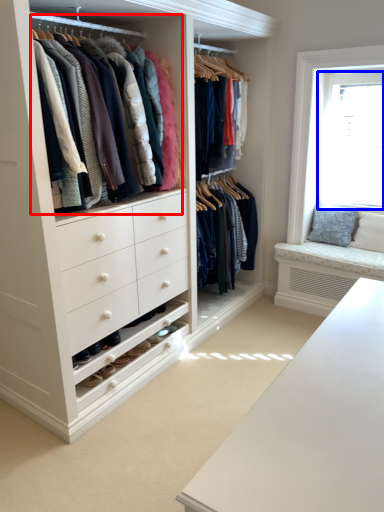
Question: Which object appears farthest to the camera in this image, closet (highlighted by a red box) or bay window (highlighted by a blue box)?

Choices:
 (A) closet
 (B) bay window

Answer: (B)